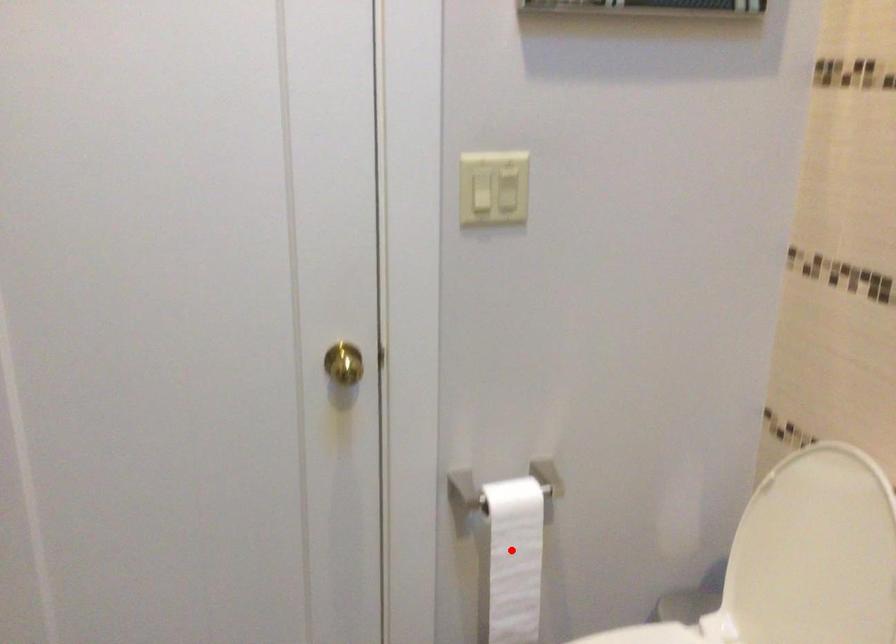
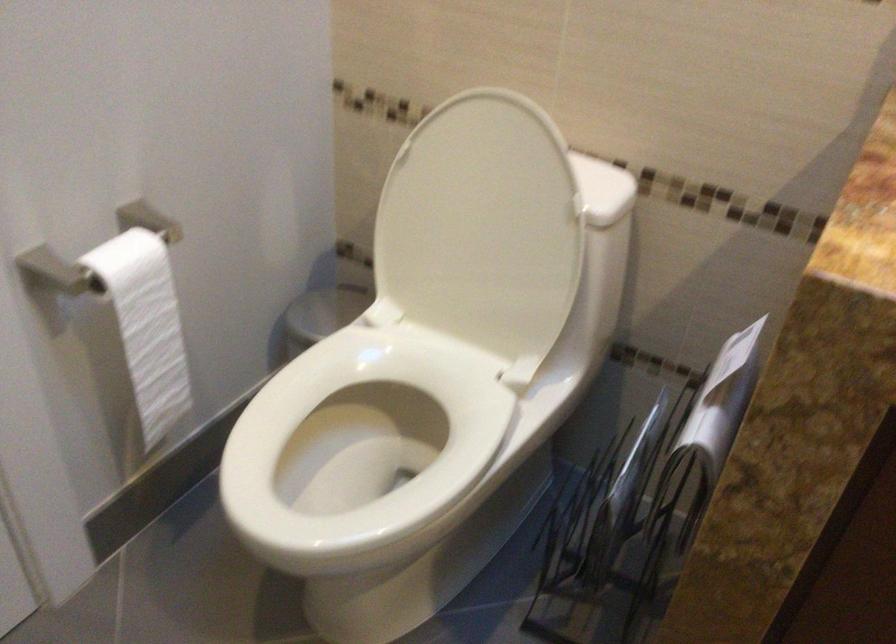
Question: A red point is marked in image1. In image2, is the corresponding 3D point closer to the camera or farther? Reply with the corresponding letter.

Choices:
 (A) The corresponding 3D point is closer.
 (B) The corresponding 3D point is farther.

Answer: (A)